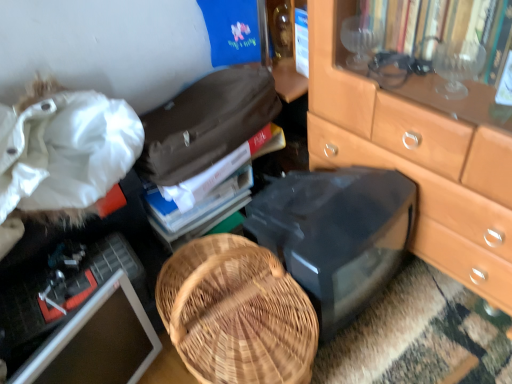
Question: From a real-world perspective, is matte black computer monitor at lower left located higher than hardcover book at center?

Choices:
 (A) yes
 (B) no

Answer: (B)

Question: Does matte black computer monitor at lower left lie behind hardcover book at center?

Choices:
 (A) yes
 (B) no

Answer: (B)

Question: Is matte black computer monitor at lower left turned away from hardcover book at center?

Choices:
 (A) yes
 (B) no

Answer: (B)

Question: Considering the relative sizes of matte black computer monitor at lower left and hardcover book at center in the image provided, is matte black computer monitor at lower left taller than hardcover book at center?

Choices:
 (A) yes
 (B) no

Answer: (A)

Question: From the image's perspective, is matte black computer monitor at lower left on top of hardcover book at center?

Choices:
 (A) no
 (B) yes

Answer: (A)

Question: Is matte black computer monitor at lower left wider than hardcover book at center?

Choices:
 (A) yes
 (B) no

Answer: (B)

Question: From the image's perspective, is hardcover book at center under black plastic desktop at center?

Choices:
 (A) yes
 (B) no

Answer: (B)

Question: Is hardcover book at center smaller than black plastic desktop at center?

Choices:
 (A) no
 (B) yes

Answer: (B)

Question: Does hardcover book at center come behind black plastic desktop at center?

Choices:
 (A) no
 (B) yes

Answer: (B)

Question: Is hardcover book at center to the right of black plastic desktop at center from the viewer's perspective?

Choices:
 (A) yes
 (B) no

Answer: (B)

Question: Are hardcover book at center and black plastic desktop at center making contact?

Choices:
 (A) yes
 (B) no

Answer: (B)

Question: Can you confirm if hardcover book at center is thinner than black plastic desktop at center?

Choices:
 (A) no
 (B) yes

Answer: (B)

Question: Is white fabric at upper left facing away from black plastic desktop at center?

Choices:
 (A) yes
 (B) no

Answer: (B)